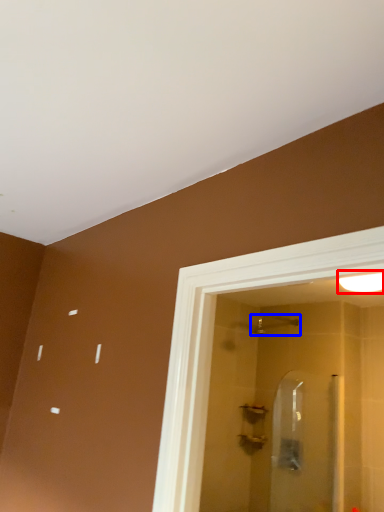
Question: Which point is further to the camera, light fixture (highlighted by a red box) or shower (highlighted by a blue box)?

Choices:
 (A) light fixture
 (B) shower

Answer: (B)